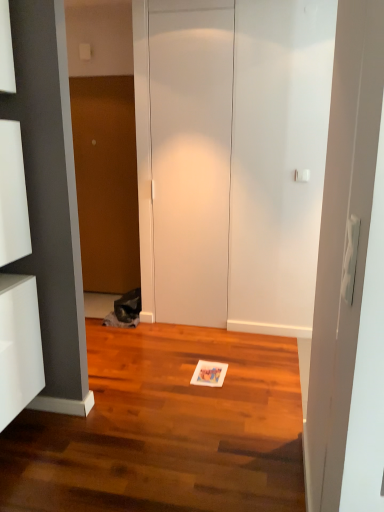
Identify the location of free point in front of white matte door at center, acting as the 1th door starting from the front. The image size is (384, 512). (194, 345).